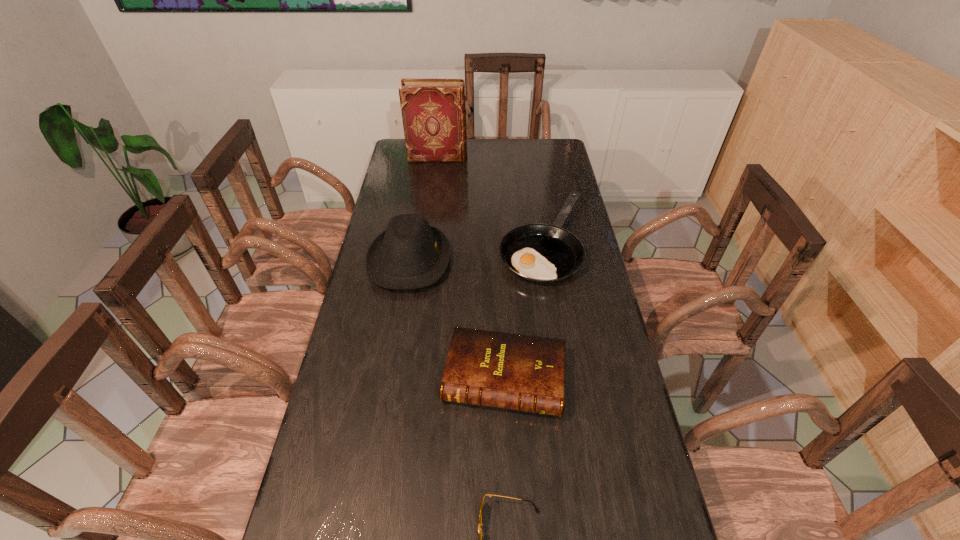
Where is `vacant space at the far right corner of the desktop`? vacant space at the far right corner of the desktop is located at coordinates (534, 141).

Where is `free spot between the nearer hardback book and the frying pan`? free spot between the nearer hardback book and the frying pan is located at coordinates (523, 310).

This screenshot has width=960, height=540. What are the coordinates of `vacant region between the frying pan and the farther hardback book` in the screenshot? It's located at (490, 200).

Image resolution: width=960 pixels, height=540 pixels. Find the location of `free point between the taller hardback book and the fourth shortest object`. free point between the taller hardback book and the fourth shortest object is located at coordinates (423, 209).

This screenshot has height=540, width=960. I want to click on object that is the second closest to the shorter hardback book, so click(481, 535).

Find the location of a particular element. The height and width of the screenshot is (540, 960). object that is the closest to the farthest object is located at coordinates (543, 253).

The width and height of the screenshot is (960, 540). Identify the location of vacant area in the image that satisfies the following two spatial constraints: 1. on the spine side of the tallest object; 2. on the right side of the fourth farthest object. (409, 378).

Where is `free location that satisfies the following two spatial constraints: 1. on the spine side of the shorter hardback book; 2. on the left side of the farther hardback book`? free location that satisfies the following two spatial constraints: 1. on the spine side of the shorter hardback book; 2. on the left side of the farther hardback book is located at coordinates (409, 378).

Identify the location of free location that satisfies the following two spatial constraints: 1. on the back side of the frying pan; 2. on the spine side of the farther hardback book. The height and width of the screenshot is (540, 960). click(x=529, y=157).

At what (x,y) coordinates should I click in order to perform the action: click on vacant point that satisfies the following two spatial constraints: 1. on the spine side of the tallest object; 2. on the left side of the frying pan. Please return your answer as a coordinate pair (x, y). The width and height of the screenshot is (960, 540). Looking at the image, I should click on (427, 242).